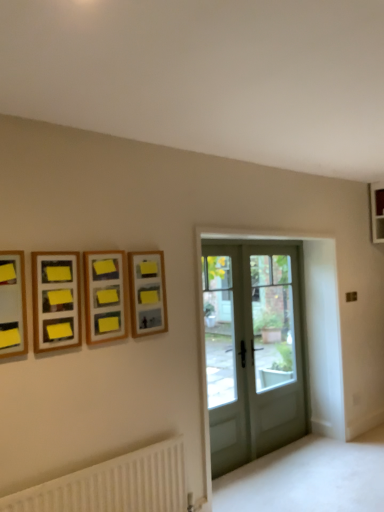
Question: Is matte glass door at center wider or thinner than wooden frame at upper left, the 2th picture frame positioned from the left?

Choices:
 (A) wide
 (B) thin

Answer: (B)

Question: Would you say matte glass door at center is to the left or to the right of wooden frame at upper left, the 2th picture frame positioned from the left, in the picture?

Choices:
 (A) right
 (B) left

Answer: (A)

Question: Estimate the real-world distances between objects in this image. Which object is closer to the clear glass door at center, the 1th screen door positioned from the front?

Choices:
 (A) wooden picture frame at left, the 1th picture frame when ordered from left to right
 (B) white textured radiator at lower left
 (C) matte glass door at center
 (D) wooden frame at upper left, which is the third picture frame from back to front
 (E) wooden frame with yellow sticky notes at upper left, which is the third picture frame from left to right

Answer: (C)

Question: Which object is the farthest from the wooden frame with yellow sticky notes at upper left, which is the third picture frame from left to right?

Choices:
 (A) wooden picture frame at left, acting as the first picture frame starting from the front
 (B) matte glass door at center
 (C) white textured radiator at lower left
 (D) wooden frame at upper center, the 1th picture frame when ordered from right to left
 (E) white glass screen door at center, acting as the 1th screen door starting from the back

Answer: (E)